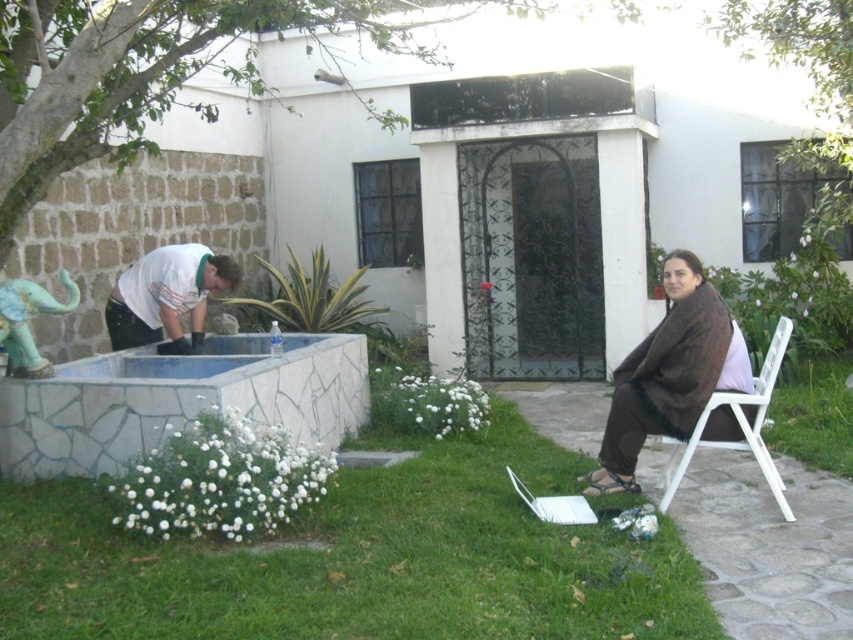
You are standing in front of the white house and want to take a photo that includes both the person tending to the water feature and the seated person with the laptop. Which of the two points, point [585,632] or point [202,301], is closer to you when you are positioned at the front of the house?

Point [585,632] is closer to the camera than point [202,301], so it will appear nearer in the photo when you are positioned at the front of the house.

From the picture: You are standing at the center of the image and want to place a small potted plant. Where should you place it so that it is closest to the green grass at lower center?

Place the small potted plant near the coordinates mentioned in the Objects Description, which is at point (358, 561), to ensure it is closest to the green grass at lower center.